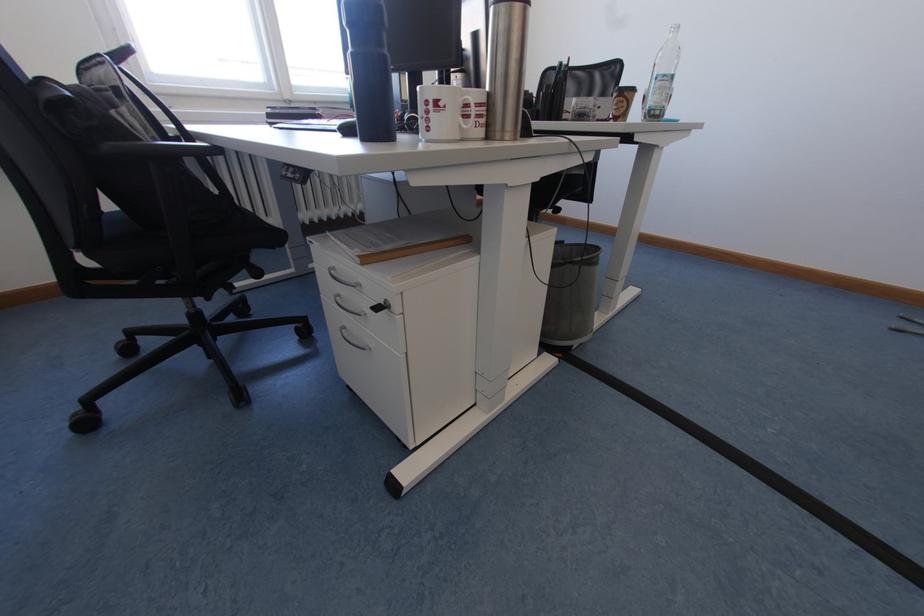
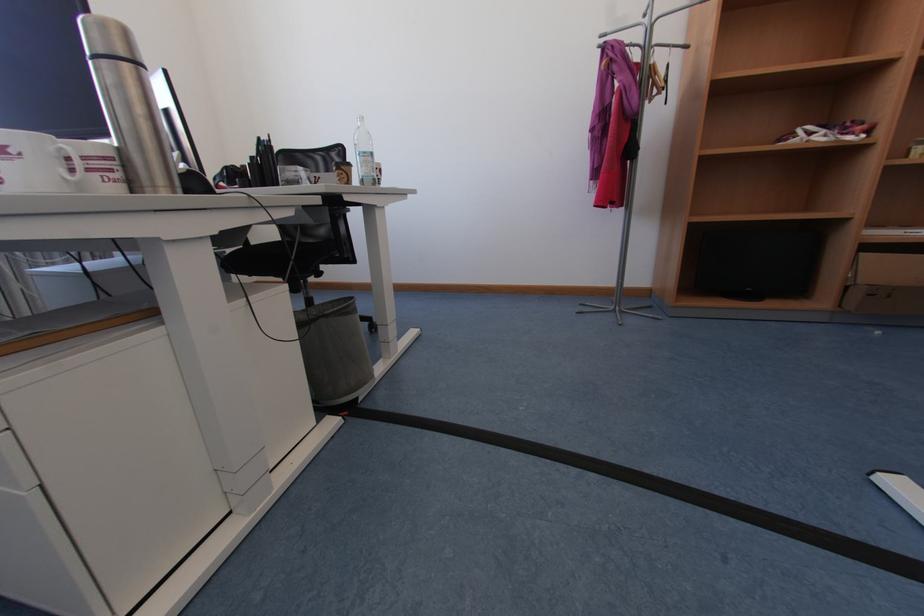
Where in the second image is the point corresponding to point (655, 108) from the first image?

(369, 177)